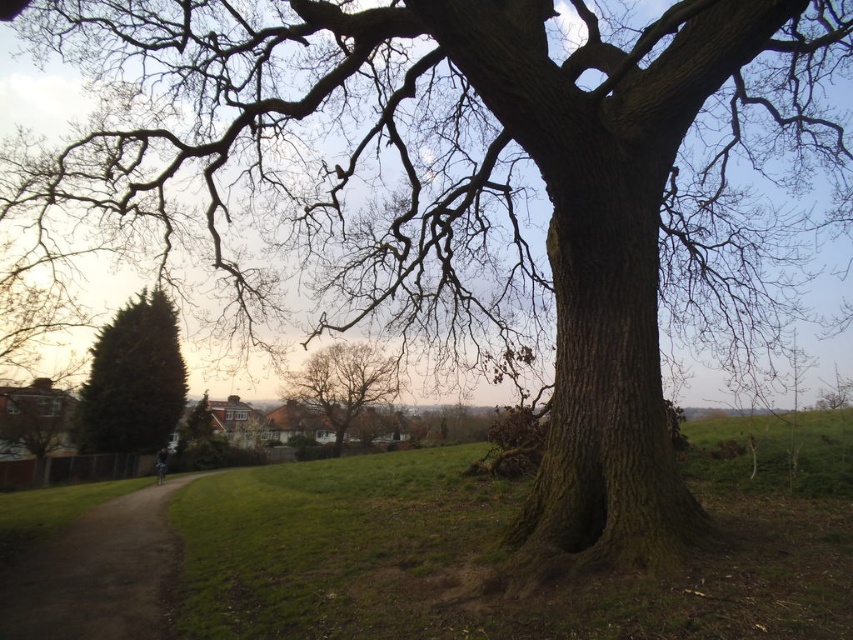
This screenshot has height=640, width=853. Describe the element at coordinates (132, 381) in the screenshot. I see `green textured hedge at left` at that location.

The image size is (853, 640). What do you see at coordinates (132, 381) in the screenshot? I see `green textured hedge at left` at bounding box center [132, 381].

This screenshot has width=853, height=640. In order to click on green textured hedge at left in this screenshot , I will do pos(132,381).

Between dirt path at lower left and bare branches at center, which one appears on the left side from the viewer's perspective?

dirt path at lower left is more to the left.

Is dirt path at lower left taller than bare branches at center?

In fact, dirt path at lower left may be shorter than bare branches at center.

Which is behind, point (141, 554) or point (315, 376)?

The point (315, 376) is behind.

The width and height of the screenshot is (853, 640). Identify the location of dirt path at lower left. (96, 573).

Does dirt path at lower left appear on the left side of green textured hedge at left?

No, dirt path at lower left is not to the left of green textured hedge at left.

Which is more to the left, dirt path at lower left or green textured hedge at left?

Positioned to the left is green textured hedge at left.

The width and height of the screenshot is (853, 640). In order to click on dirt path at lower left in this screenshot , I will do `click(96, 573)`.

Where is `dirt path at lower left`? This screenshot has width=853, height=640. dirt path at lower left is located at coordinates (96, 573).